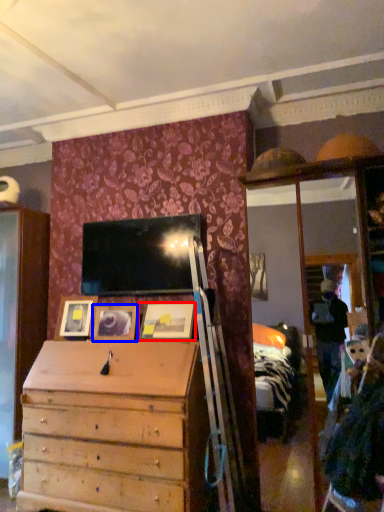
Question: Which object is further to the camera taking this photo, picture frame (highlighted by a red box) or picture frame (highlighted by a blue box)?

Choices:
 (A) picture frame
 (B) picture frame

Answer: (B)